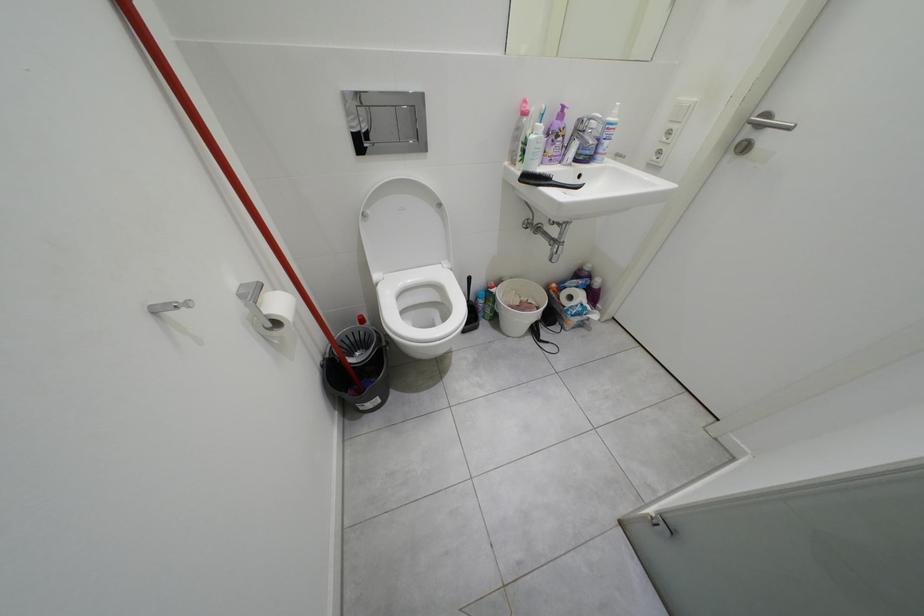
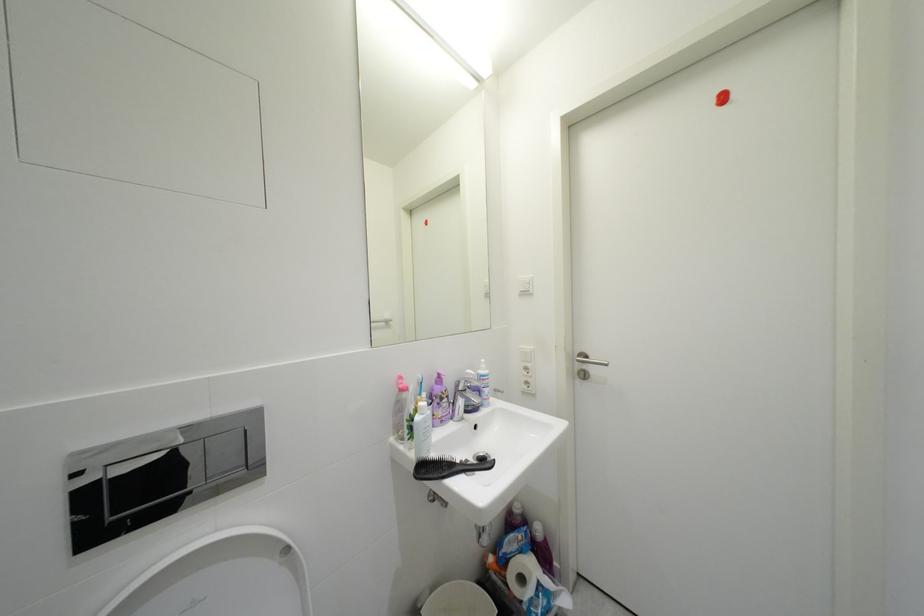
How did the camera likely rotate?

The camera rotated toward right-up.